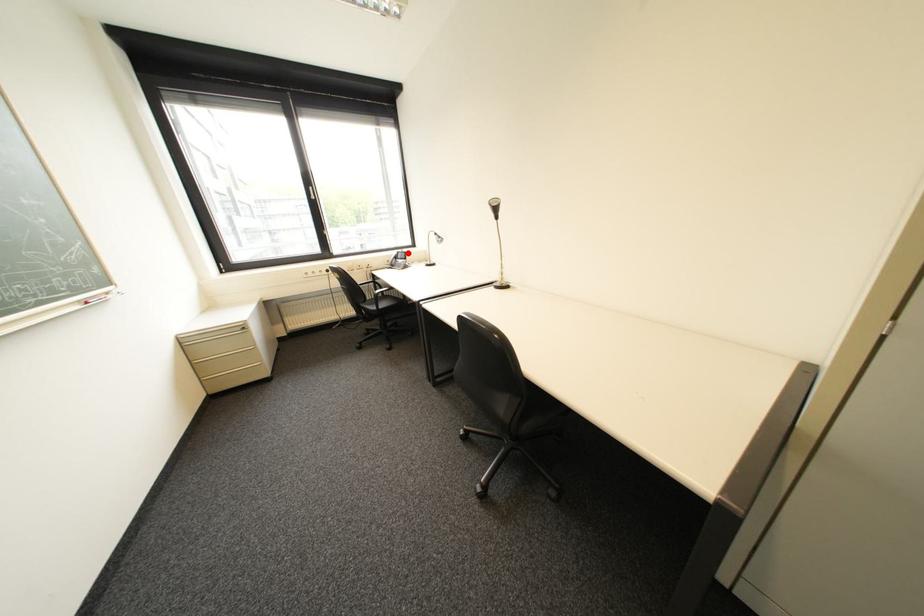
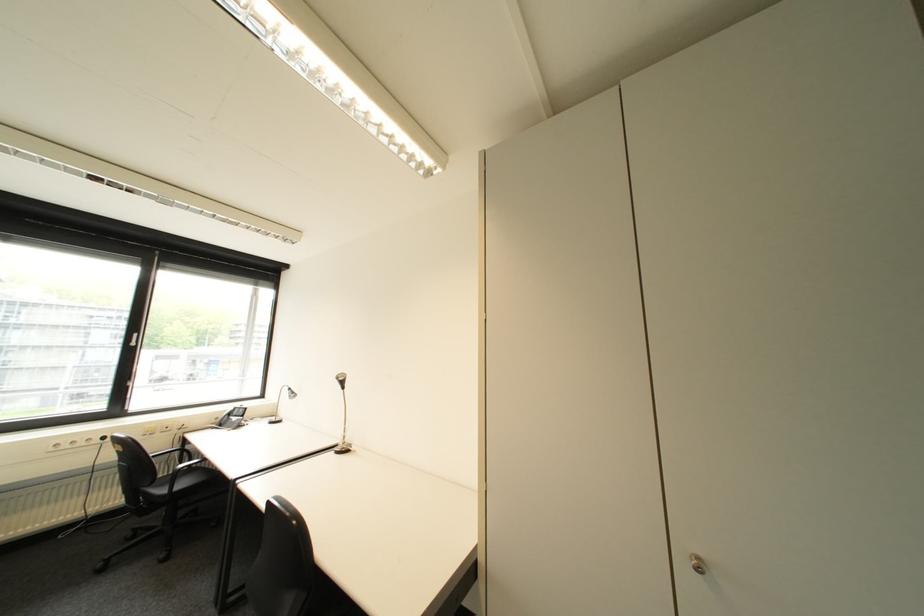
Question: A red point is marked in image1. In image2, is the corresponding 3D point closer to the camera or farther? Reply with the corresponding letter.

Choices:
 (A) The corresponding 3D point is closer.
 (B) The corresponding 3D point is farther.

Answer: (B)